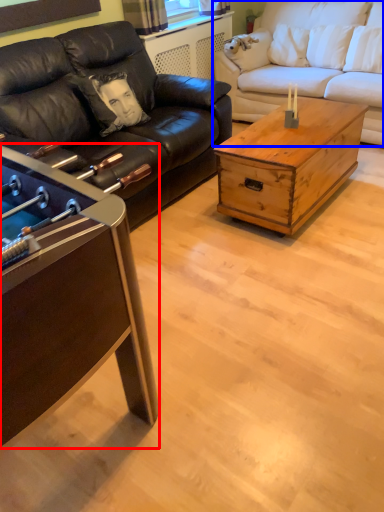
Question: Which of the following is the closest to the observer, coffee table (highlighted by a red box) or studio couch (highlighted by a blue box)?

Choices:
 (A) coffee table
 (B) studio couch

Answer: (A)